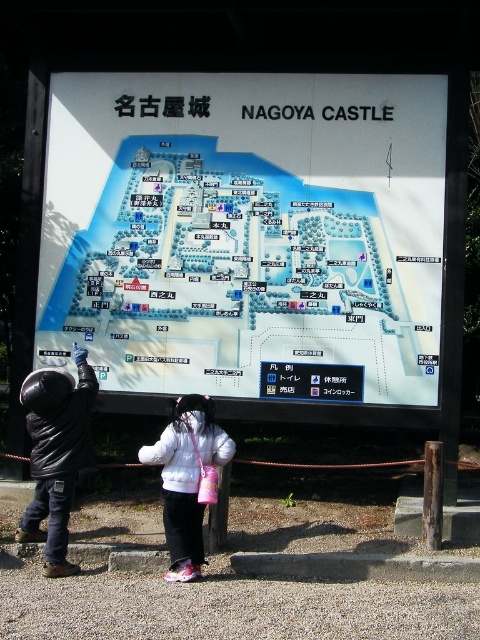
Is white fluffy jacket at center wider than white plastic sign at center?

Incorrect, white fluffy jacket at center's width does not surpass white plastic sign at center's.

Is point (175, 506) more distant than point (354, 380)?

No, it is in front of (354, 380).

Between point (182, 456) and point (307, 390), which one is positioned behind?

Positioned behind is point (307, 390).

Find the location of `white fluffy jacket at center`. white fluffy jacket at center is located at coordinates (187, 477).

Is white paper map at center below black matte jacket at lower left?

No.

Where is `white paper map at center`? Image resolution: width=480 pixels, height=640 pixels. white paper map at center is located at coordinates (244, 228).

Locate an element on the screen. This screenshot has height=640, width=480. white paper map at center is located at coordinates (244, 228).

At what (x,y) coordinates should I click in order to perform the action: click on white paper map at center. Please return your answer as a coordinate pair (x, y). The width and height of the screenshot is (480, 640). Looking at the image, I should click on (244, 228).

Is black matte jacket at lower left wider than white fluffy jacket at center?

No, black matte jacket at lower left is not wider than white fluffy jacket at center.

Can you confirm if black matte jacket at lower left is thinner than white fluffy jacket at center?

Indeed, black matte jacket at lower left has a lesser width compared to white fluffy jacket at center.

This screenshot has height=640, width=480. Describe the element at coordinates (57, 452) in the screenshot. I see `black matte jacket at lower left` at that location.

Locate an element on the screen. Image resolution: width=480 pixels, height=640 pixels. black matte jacket at lower left is located at coordinates pyautogui.click(x=57, y=452).